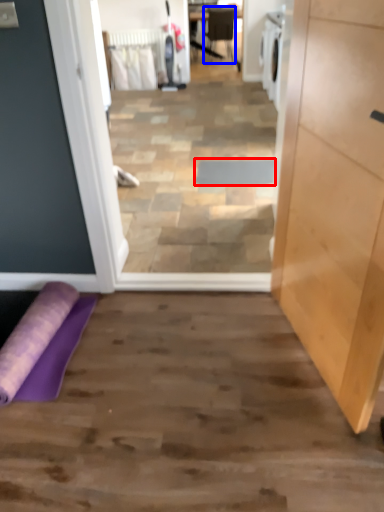
Question: Which of the following is the farthest to the observer, doormat (highlighted by a red box) or chair (highlighted by a blue box)?

Choices:
 (A) doormat
 (B) chair

Answer: (B)